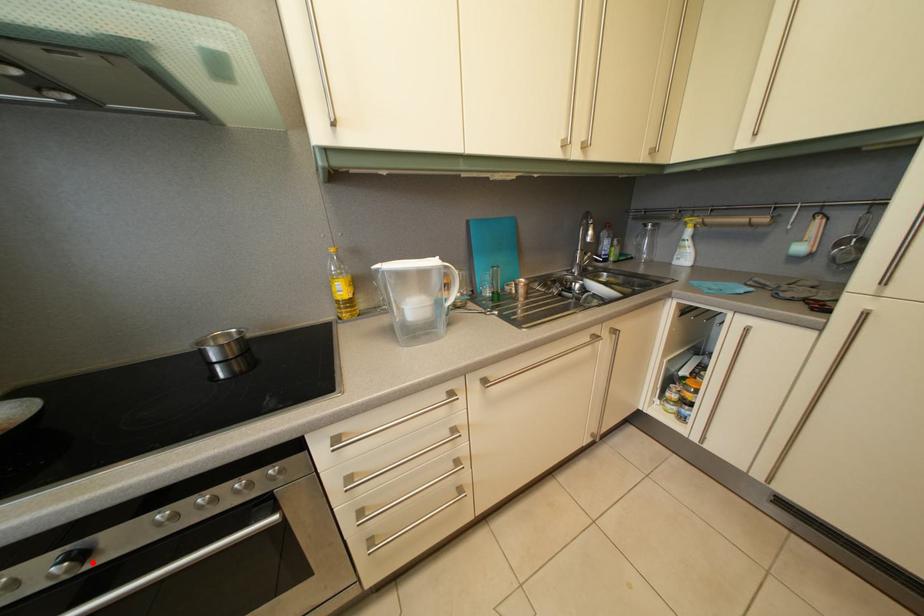
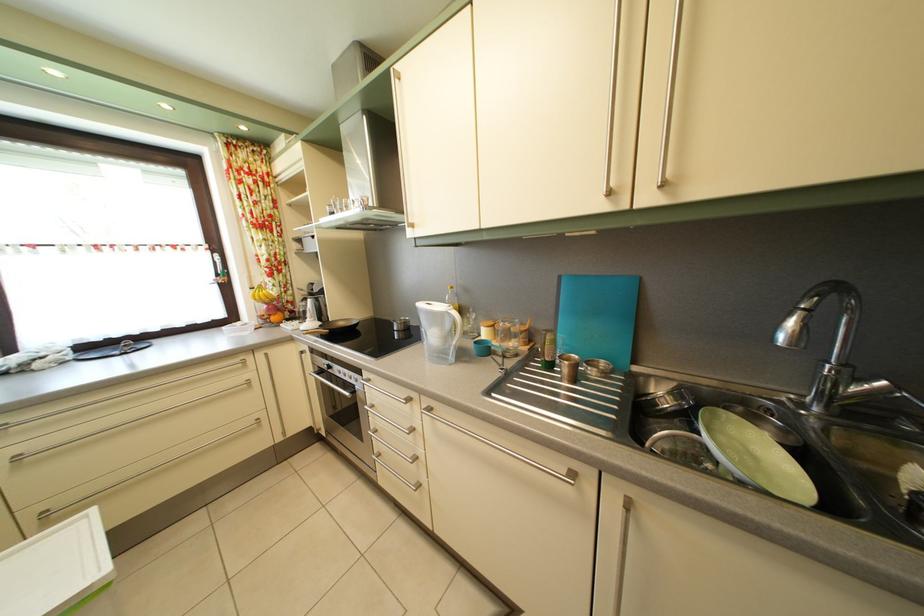
Question: A red point is marked in image1. In image2, is the corresponding 3D point closer to the camera or farther? Reply with the corresponding letter.

Choices:
 (A) The corresponding 3D point is closer.
 (B) The corresponding 3D point is farther.

Answer: (B)